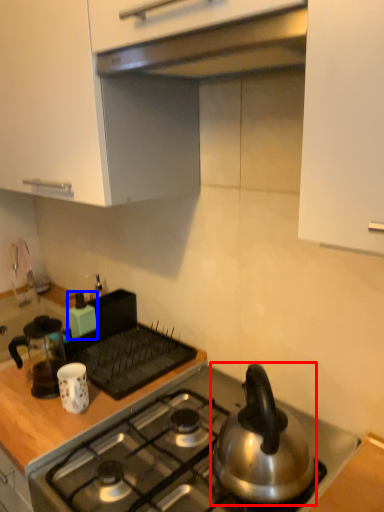
Question: Which point is closer to the camera, kettle (highlighted by a red box) or kitchen appliance (highlighted by a blue box)?

Choices:
 (A) kettle
 (B) kitchen appliance

Answer: (A)